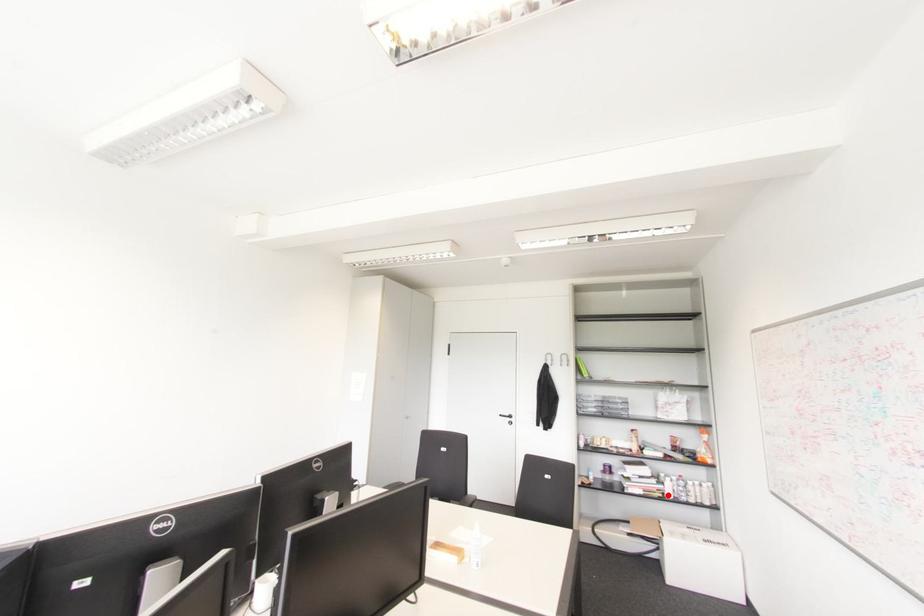
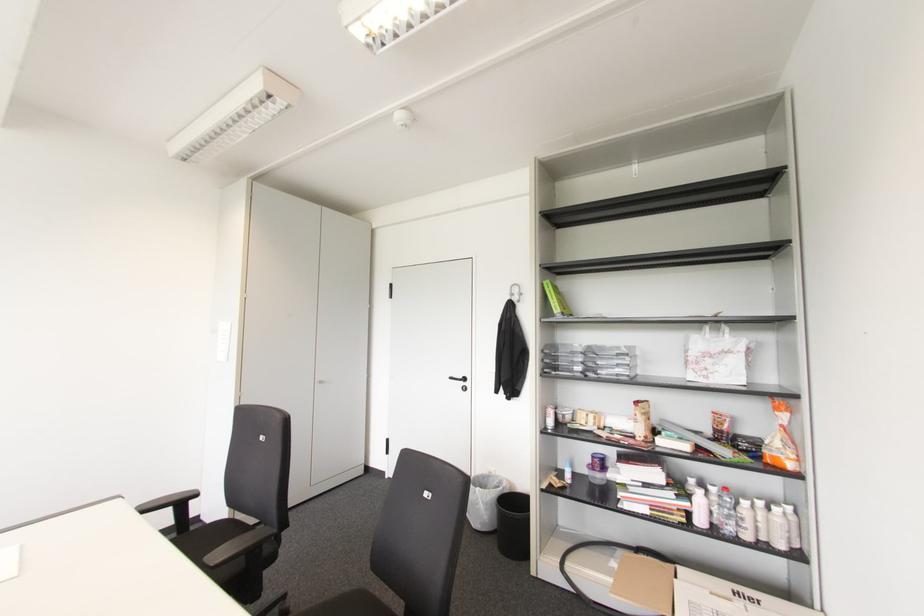
Question: I am providing you with two images of the same scene from different viewpoints. In image1, a red point is highlighted. Considering the same 3D point in image2, which of the following is correct?

Choices:
 (A) It is closer
 (B) It is farther

Answer: (A)